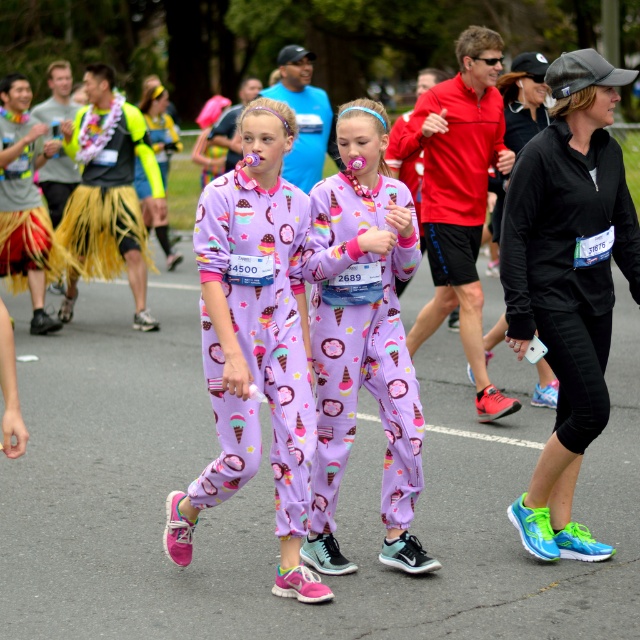
Consider the image. You are a photographer standing at the starting line of the race. You want to capture a photo of the point at coordinates point (305,467). Given that your camera can focus up to 6 meters, will you be able to capture the point clearly?

The distance of point (305,467) from the camera is 6.25 meters, which is beyond the camera focus limit of 6 meters. Therefore, the point will not be captured clearly.

Consider the image. You are a photographer at the race start line. You see the neon green running shoes at center and the purple cotton onesie at center. Which object is higher up in the image?

The neon green running shoes at center are higher up in the image than the purple cotton onesie at center.

You are a photographer at the community event and need to capture a closeup shot of both the neon green running shoes at center and the lavender soft fabric onesie at center. Given that your camera has a fixed focus range that can only accommodate objects of the same width, will you need to adjust the focus to ensure both are in frame?

The neon green running shoes at center are wider than the lavender soft fabric onesie at center, so you will need to adjust the focus to ensure both are in frame since their widths differ.